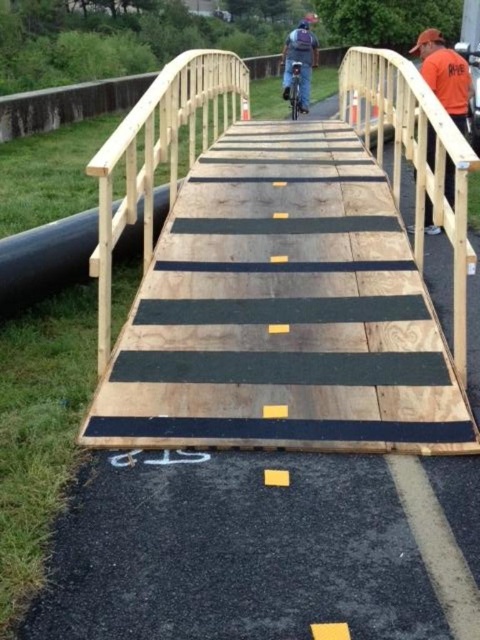
Does wooden bridge at center appear on the left side of orange cotton shirt at upper right?

Indeed, wooden bridge at center is positioned on the left side of orange cotton shirt at upper right.

Identify the location of wooden bridge at center. The image size is (480, 640). click(283, 273).

I want to click on wooden bridge at center, so click(x=283, y=273).

Between point (422, 314) and point (307, 54), which one is positioned behind?

Point (307, 54)

Is point (400, 145) in front of point (303, 100)?

Yes, point (400, 145) is closer to viewer.

Which is in front, point (445, 403) or point (308, 92)?

Point (445, 403) is in front.

Where is `wooden bridge at center`? The image size is (480, 640). wooden bridge at center is located at coordinates (283, 273).

Where is `orange cotton shirt at upper right`? Image resolution: width=480 pixels, height=640 pixels. orange cotton shirt at upper right is located at coordinates point(444,74).

Does orange cotton shirt at upper right appear under denim jacket at center?

Yes.

The height and width of the screenshot is (640, 480). In order to click on orange cotton shirt at upper right in this screenshot , I will do `click(444, 74)`.